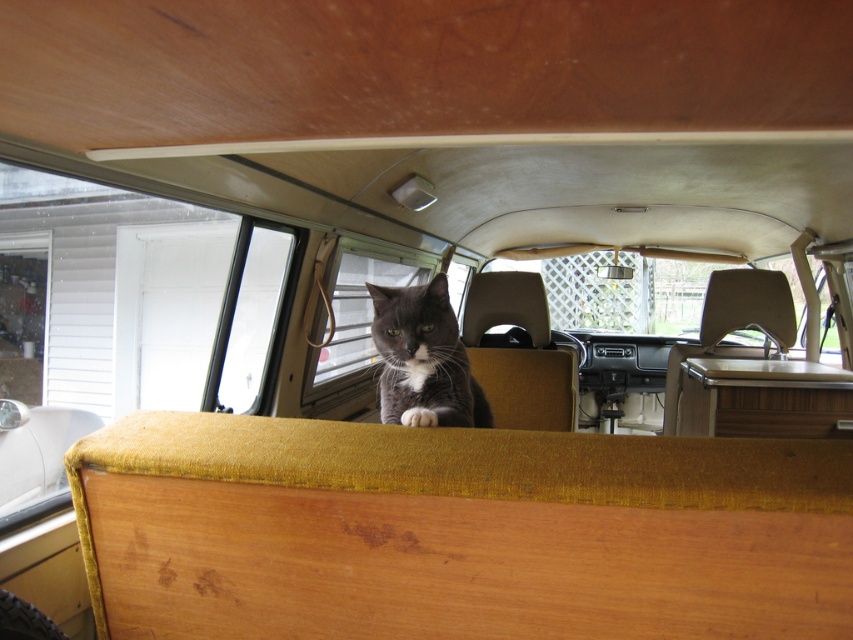
Question: Which point is farther from the camera taking this photo?

Choices:
 (A) (358, 346)
 (B) (473, 394)

Answer: (A)

Question: Which is nearer to the gray fur cat at center?

Choices:
 (A) clear glass window at center
 (B) transparent glass window at left

Answer: (A)

Question: Does gray fur cat at center appear on the right side of clear glass window at center?

Choices:
 (A) yes
 (B) no

Answer: (A)

Question: Is clear glass window at center in front of transparent glass window at left?

Choices:
 (A) yes
 (B) no

Answer: (A)

Question: Is gray fur cat at center above transparent glass window at left?

Choices:
 (A) no
 (B) yes

Answer: (A)

Question: Based on their relative distances, which object is farther from the transparent glass window at left?

Choices:
 (A) gray fur cat at center
 (B) clear glass window at center

Answer: (A)